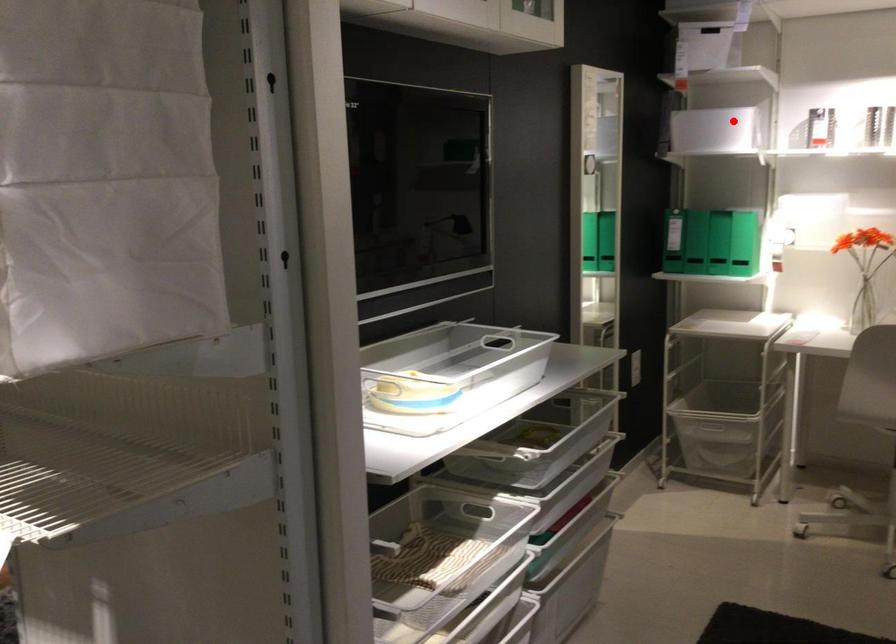
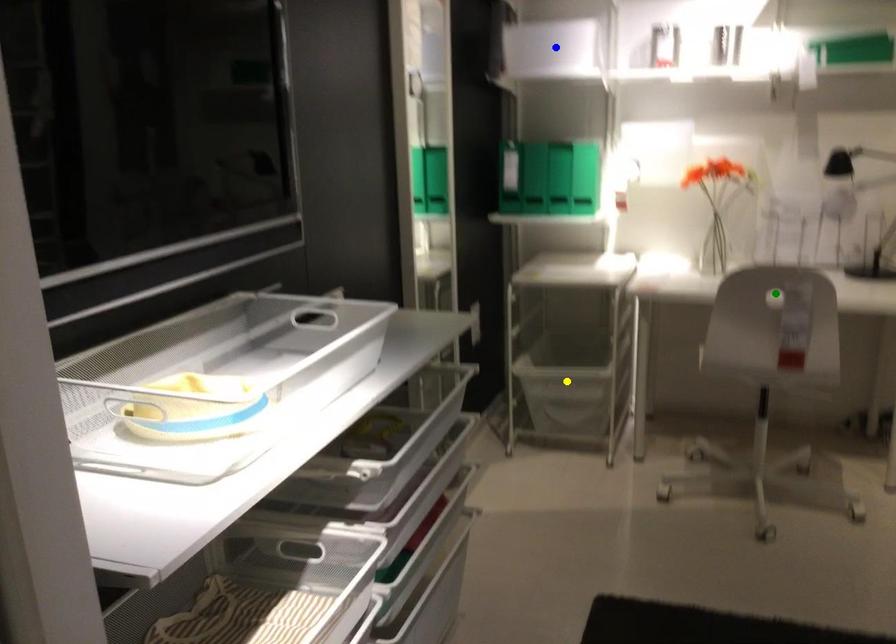
Question: I am providing you with two images of the same scene from different viewpoints. A red point is marked on the first image. You are given multiple points on the second image. Which mark in image 2 goes with the point in image 1?

Choices:
 (A) blue point
 (B) yellow point
 (C) green point

Answer: (A)